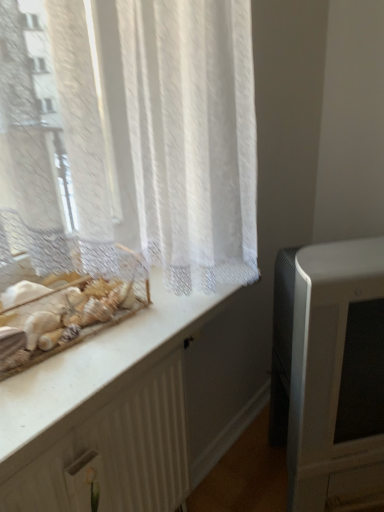
Question: Is white textured radiator at lower left next to white marble counter at upper left?

Choices:
 (A) no
 (B) yes

Answer: (B)

Question: Is white textured radiator at lower left oriented away from white marble counter at upper left?

Choices:
 (A) yes
 (B) no

Answer: (B)

Question: From a real-world perspective, is white textured radiator at lower left under white marble counter at upper left?

Choices:
 (A) no
 (B) yes

Answer: (B)

Question: Does white textured radiator at lower left appear on the right side of white marble counter at upper left?

Choices:
 (A) no
 (B) yes

Answer: (B)

Question: Is white textured radiator at lower left positioned in front of white marble counter at upper left?

Choices:
 (A) yes
 (B) no

Answer: (B)

Question: From the image's perspective, is white textured radiator at lower left under white marble counter at upper left?

Choices:
 (A) no
 (B) yes

Answer: (B)

Question: Is matte white television at right facing towards white marble counter at upper left?

Choices:
 (A) yes
 (B) no

Answer: (B)

Question: From a real-world perspective, is matte white television at right physically below white marble counter at upper left?

Choices:
 (A) no
 (B) yes

Answer: (B)

Question: Is matte white television at right turned away from white marble counter at upper left?

Choices:
 (A) yes
 (B) no

Answer: (B)

Question: Is the depth of matte white television at right less than that of white marble counter at upper left?

Choices:
 (A) yes
 (B) no

Answer: (B)

Question: From the image's perspective, is matte white television at right below white marble counter at upper left?

Choices:
 (A) no
 (B) yes

Answer: (B)

Question: Considering the relative sizes of matte white television at right and white marble counter at upper left in the image provided, is matte white television at right bigger than white marble counter at upper left?

Choices:
 (A) yes
 (B) no

Answer: (A)

Question: Is there a large distance between white textured radiator at lower left and matte white television at right?

Choices:
 (A) no
 (B) yes

Answer: (A)